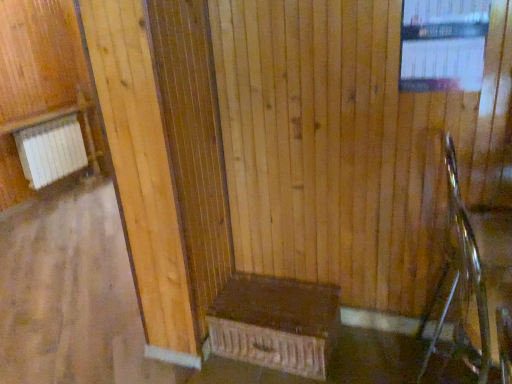
Question: Is transparent glass window at upper right behind dark brown wood bench at center?

Choices:
 (A) no
 (B) yes

Answer: (A)

Question: From a real-world perspective, is transparent glass window at upper right located beneath dark brown wood bench at center?

Choices:
 (A) yes
 (B) no

Answer: (B)

Question: Is transparent glass window at upper right bigger than dark brown wood bench at center?

Choices:
 (A) no
 (B) yes

Answer: (A)

Question: Does transparent glass window at upper right have a lesser height compared to dark brown wood bench at center?

Choices:
 (A) yes
 (B) no

Answer: (B)

Question: Is transparent glass window at upper right oriented towards dark brown wood bench at center?

Choices:
 (A) no
 (B) yes

Answer: (A)

Question: From the image's perspective, relative to dark brown wood bench at center, is metallic silver rocking chair at right above or below?

Choices:
 (A) below
 (B) above

Answer: (B)

Question: Is metallic silver rocking chair at right in front of or behind dark brown wood bench at center in the image?

Choices:
 (A) behind
 (B) front

Answer: (B)

Question: Considering the positions of metallic silver rocking chair at right and dark brown wood bench at center in the image, is metallic silver rocking chair at right taller or shorter than dark brown wood bench at center?

Choices:
 (A) tall
 (B) short

Answer: (A)

Question: Looking at their shapes, would you say metallic silver rocking chair at right is wider or thinner than dark brown wood bench at center?

Choices:
 (A) wide
 (B) thin

Answer: (B)

Question: Considering their positions, is dark brown wood bench at center located in front of or behind transparent glass window at upper right?

Choices:
 (A) front
 (B) behind

Answer: (B)

Question: From a real-world perspective, is dark brown wood bench at center positioned above or below transparent glass window at upper right?

Choices:
 (A) above
 (B) below

Answer: (B)

Question: Is dark brown wood bench at center taller or shorter than transparent glass window at upper right?

Choices:
 (A) short
 (B) tall

Answer: (A)

Question: Is dark brown wood bench at center situated inside transparent glass window at upper right or outside?

Choices:
 (A) outside
 (B) inside

Answer: (A)

Question: Is transparent glass window at upper right in front of or behind dark brown wood bench at center in the image?

Choices:
 (A) behind
 (B) front

Answer: (B)

Question: Looking at their shapes, would you say transparent glass window at upper right is wider or thinner than dark brown wood bench at center?

Choices:
 (A) wide
 (B) thin

Answer: (B)